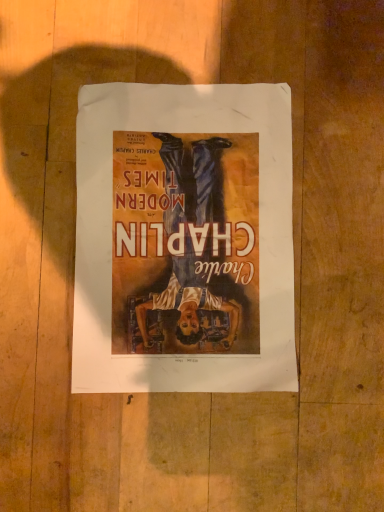
You are a GUI agent. You are given a task and a screenshot of the screen. Output one action in this format:
    pyautogui.click(x=<x>, y=<y>)
    Task: Click on the matte paper poster at center
    
    Given the screenshot: What is the action you would take?
    184,239

Describe the element at coordinates (184, 239) in the screenshot. I see `matte paper poster at center` at that location.

The width and height of the screenshot is (384, 512). I want to click on matte paper poster at center, so click(184, 239).